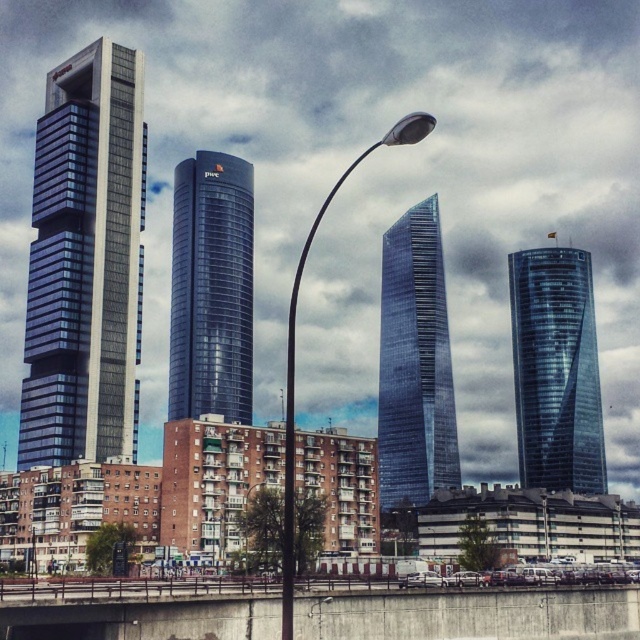
Locate an element on the screen. Image resolution: width=640 pixels, height=640 pixels. transparent glass skyscraper at right is located at coordinates (556, 371).

Between transparent glass skyscraper at right and shiny glass skyscraper at center, which one appears on the left side from the viewer's perspective?

shiny glass skyscraper at center is more to the left.

Between point (554, 339) and point (410, 436), which one is positioned in front?

Point (410, 436)

Where is `transparent glass skyscraper at right`? The width and height of the screenshot is (640, 640). transparent glass skyscraper at right is located at coordinates (556, 371).

Can you confirm if glossy glass tower at center is taller than metallic pole at center?

Yes.

Does glossy glass tower at center have a lesser width compared to metallic pole at center?

No.

Locate an element on the screen. This screenshot has height=640, width=640. glossy glass tower at center is located at coordinates (211, 289).

The image size is (640, 640). What are the coordinates of `glossy glass tower at center` in the screenshot? It's located at (211, 289).

Does glassy blue skyscraper at left have a larger size compared to shiny glass skyscraper at center?

Actually, glassy blue skyscraper at left might be smaller than shiny glass skyscraper at center.

Is point (141, 216) closer to camera compared to point (417, 225)?

Yes, it is in front of point (417, 225).

Which is behind, point (36, 371) or point (392, 273)?

Point (392, 273)

Where is `glassy blue skyscraper at left`? glassy blue skyscraper at left is located at coordinates (84, 262).